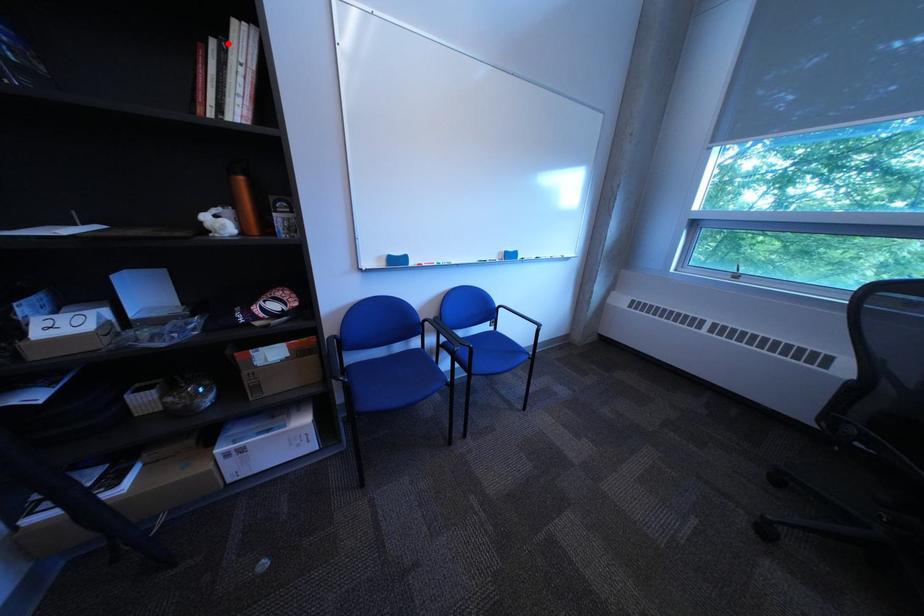
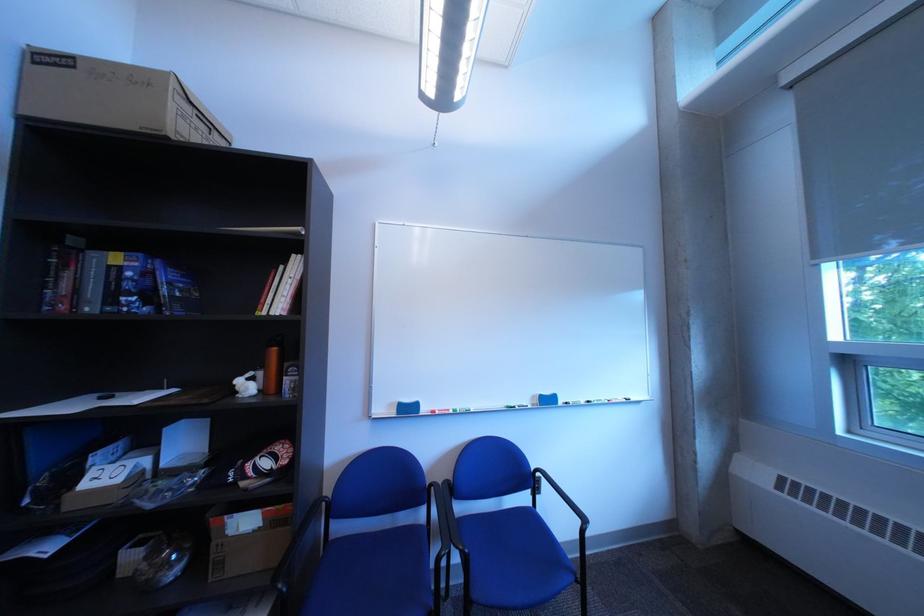
Where in the second image is the point corresponding to the highlighted location from the first image?

(297, 270)